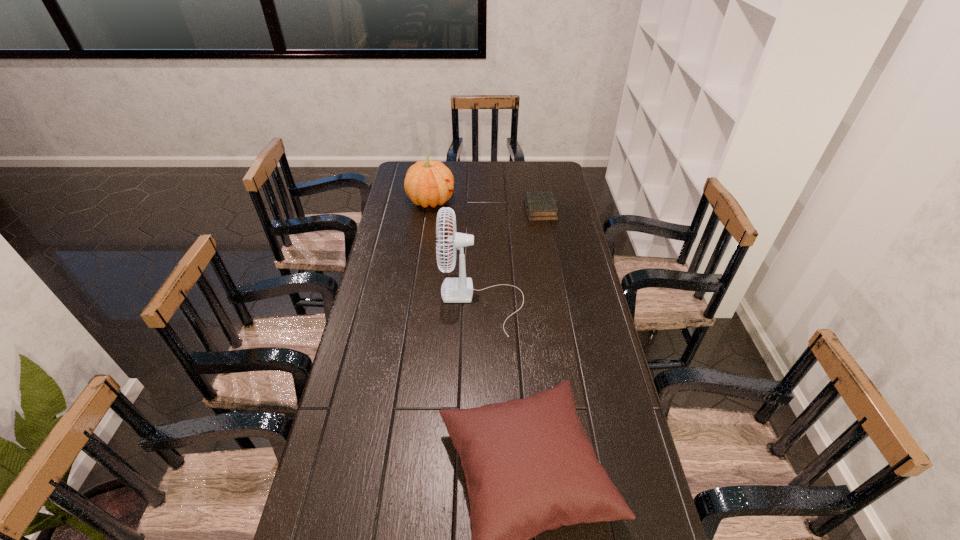
Locate an element on the screen. The height and width of the screenshot is (540, 960). fan is located at coordinates (453, 290).

The height and width of the screenshot is (540, 960). What are the coordinates of `the tallest object` in the screenshot? It's located at (453, 290).

The width and height of the screenshot is (960, 540). I want to click on pumpkin, so click(x=426, y=183).

Identify the location of the shortest object. This screenshot has height=540, width=960. (540, 206).

At what (x,y) coordinates should I click in order to perform the action: click on vacant region located on the front-facing side of the fan. Please return your answer as a coordinate pair (x, y). Looking at the image, I should click on (420, 302).

This screenshot has height=540, width=960. I want to click on vacant area situated on the front-facing side of the fan, so click(x=403, y=302).

The height and width of the screenshot is (540, 960). I want to click on free location located on the front-facing side of the fan, so click(x=387, y=302).

Where is `free space located on the carved face of the third shortest object`? The height and width of the screenshot is (540, 960). free space located on the carved face of the third shortest object is located at coordinates (476, 201).

What are the coordinates of `blank area located 0.070m on the left of the shortest object` in the screenshot? It's located at (510, 210).

The height and width of the screenshot is (540, 960). What are the coordinates of `object present at the left edge` in the screenshot? It's located at (426, 183).